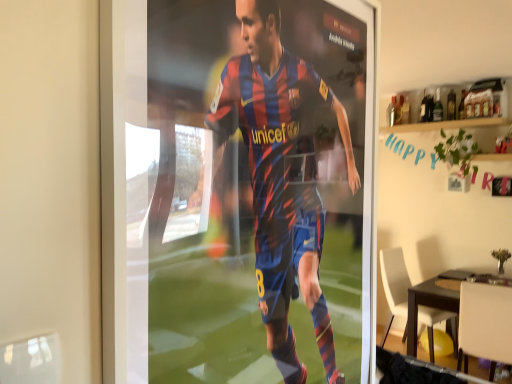
Describe the element at coordinates (485, 324) in the screenshot. I see `white matte chair at lower right, which appears as the first chair when viewed from the front` at that location.

At what (x,y) coordinates should I click in order to perform the action: click on white plastic chair at lower right, the 2th chair from the front. Please return your answer as a coordinate pair (x, y). Looking at the image, I should click on (394, 284).

I want to click on white matte chair at lower right, which appears as the first chair when viewed from the front, so click(485, 324).

Is point (456, 320) closer to camera compared to point (386, 261)?

Yes, it is.

Is dark brown wooden table at lower right facing towards white plastic chair at lower right, arranged as the first chair when viewed from the back?

No, dark brown wooden table at lower right does not turn towards white plastic chair at lower right, arranged as the first chair when viewed from the back.

Would you say dark brown wooden table at lower right is to the left or to the right of white plastic chair at lower right, the 2th chair from the front, in the picture?

From the image, it's evident that dark brown wooden table at lower right is to the right of white plastic chair at lower right, the 2th chair from the front.

From the image's perspective, does dark brown wooden table at lower right appear higher than white plastic chair at lower right, arranged as the first chair when viewed from the back?

No, from the image's perspective, dark brown wooden table at lower right is not above white plastic chair at lower right, arranged as the first chair when viewed from the back.

In the scene shown: Would you say dark brown wooden table at lower right is to the left or to the right of white matte chair at lower right, which ranks as the 2th chair in back-to-front order, in the picture?

dark brown wooden table at lower right is positioned on white matte chair at lower right, which ranks as the 2th chair in back-to-front order,'s right side.

Considering the sizes of dark brown wooden table at lower right and white matte chair at lower right, which ranks as the 2th chair in back-to-front order, in the image, is dark brown wooden table at lower right taller or shorter than white matte chair at lower right, which ranks as the 2th chair in back-to-front order,?

Clearly, dark brown wooden table at lower right is shorter compared to white matte chair at lower right, which ranks as the 2th chair in back-to-front order.

Considering the relative sizes of dark brown wooden table at lower right and white matte chair at lower right, which ranks as the 2th chair in back-to-front order, in the image provided, is dark brown wooden table at lower right wider than white matte chair at lower right, which ranks as the 2th chair in back-to-front order,?

Yes.

From a real-world perspective, is dark brown wooden table at lower right positioned over white matte chair at lower right, which appears as the first chair when viewed from the front, based on gravity?

No, from a real-world perspective, dark brown wooden table at lower right is not above white matte chair at lower right, which appears as the first chair when viewed from the front.

Between white plastic chair at lower right, the 2th chair from the front, and dark brown wooden table at lower right, which one has more height?

white plastic chair at lower right, the 2th chair from the front, is taller.

In the image, is white plastic chair at lower right, arranged as the first chair when viewed from the back, on the left side or the right side of dark brown wooden table at lower right?

white plastic chair at lower right, arranged as the first chair when viewed from the back, is to the left of dark brown wooden table at lower right.

From the image's perspective, is white plastic chair at lower right, arranged as the first chair when viewed from the back, positioned above or below dark brown wooden table at lower right?

From the image's perspective, white plastic chair at lower right, arranged as the first chair when viewed from the back, appears above dark brown wooden table at lower right.

At what (x,y) coordinates should I click in order to perform the action: click on table to the right of white plastic chair at lower right, the 2th chair from the front. Please return your answer as a coordinate pair (x, y). Looking at the image, I should click on (433, 299).

Which object is positioned more to the left, white plastic chair at lower right, the 2th chair from the front, or white matte chair at lower right, which appears as the first chair when viewed from the front?

From the viewer's perspective, white plastic chair at lower right, the 2th chair from the front, appears more on the left side.

How distant is white plastic chair at lower right, the 2th chair from the front, from white matte chair at lower right, which appears as the first chair when viewed from the front?

The distance of white plastic chair at lower right, the 2th chair from the front, from white matte chair at lower right, which appears as the first chair when viewed from the front, is 3.86 feet.

Consider the image. From the image's perspective, relative to white matte chair at lower right, which ranks as the 2th chair in back-to-front order, is white plastic chair at lower right, arranged as the first chair when viewed from the back, above or below?

white plastic chair at lower right, arranged as the first chair when viewed from the back, is situated higher than white matte chair at lower right, which ranks as the 2th chair in back-to-front order, in the image.

You are a GUI agent. You are given a task and a screenshot of the screen. Output one action in this format:
    pyautogui.click(x=<x>, y=<y>)
    Task: Click on the chair that is below the white plastic chair at lower right, arranged as the first chair when viewed from the back (from the image's perspective)
    The width and height of the screenshot is (512, 384).
    Given the screenshot: What is the action you would take?
    pyautogui.click(x=485, y=324)

Consider the image. Which is more distant, (510,313) or (441,298)?

The point (441,298) is farther from the camera.

Is white matte chair at lower right, which appears as the first chair when viewed from the front, not within dark brown wooden table at lower right?

Actually, white matte chair at lower right, which appears as the first chair when viewed from the front, is at least partially inside dark brown wooden table at lower right.

Between white matte chair at lower right, which ranks as the 2th chair in back-to-front order, and dark brown wooden table at lower right, which one appears on the right side from the viewer's perspective?

dark brown wooden table at lower right.

Is the depth of white matte chair at lower right, which ranks as the 2th chair in back-to-front order, greater than that of dark brown wooden table at lower right?

No, it is not.

From the picture: Does white matte chair at lower right, which appears as the first chair when viewed from the front, have a lesser height compared to white plastic chair at lower right, arranged as the first chair when viewed from the back?

Yes, white matte chair at lower right, which appears as the first chair when viewed from the front, is shorter than white plastic chair at lower right, arranged as the first chair when viewed from the back.

Can we say white matte chair at lower right, which ranks as the 2th chair in back-to-front order, lies outside white plastic chair at lower right, arranged as the first chair when viewed from the back?

Yes, white matte chair at lower right, which ranks as the 2th chair in back-to-front order, is not within white plastic chair at lower right, arranged as the first chair when viewed from the back.

In terms of width, does white matte chair at lower right, which ranks as the 2th chair in back-to-front order, look wider or thinner when compared to white plastic chair at lower right, arranged as the first chair when viewed from the back?

In the image, white matte chair at lower right, which ranks as the 2th chair in back-to-front order, appears to be wider than white plastic chair at lower right, arranged as the first chair when viewed from the back.

From a real-world perspective, is white matte chair at lower right, which appears as the first chair when viewed from the front, under white plastic chair at lower right, arranged as the first chair when viewed from the back?

Actually, white matte chair at lower right, which appears as the first chair when viewed from the front, is physically above white plastic chair at lower right, arranged as the first chair when viewed from the back, in the real world.

This screenshot has width=512, height=384. I want to click on table below the white plastic chair at lower right, the 2th chair from the front (from a real-world perspective), so click(433, 299).

Identify the location of table behind the white matte chair at lower right, which appears as the first chair when viewed from the front. The height and width of the screenshot is (384, 512). click(433, 299).

Looking at the image, which one is located further to dark brown wooden table at lower right, white matte chair at lower right, which appears as the first chair when viewed from the front, or white plastic chair at lower right, the 2th chair from the front?

white matte chair at lower right, which appears as the first chair when viewed from the front, is further to dark brown wooden table at lower right.

In the scene shown: Which object lies further to the anchor point white matte chair at lower right, which appears as the first chair when viewed from the front, white plastic chair at lower right, the 2th chair from the front, or dark brown wooden table at lower right?

white plastic chair at lower right, the 2th chair from the front, is positioned further to the anchor white matte chair at lower right, which appears as the first chair when viewed from the front.

From the picture: Considering their positions, is dark brown wooden table at lower right positioned closer to white matte chair at lower right, which appears as the first chair when viewed from the front, than white plastic chair at lower right, the 2th chair from the front?

dark brown wooden table at lower right lies closer to white matte chair at lower right, which appears as the first chair when viewed from the front, than the other object.

Based on the photo, when comparing their distances from white plastic chair at lower right, the 2th chair from the front, does dark brown wooden table at lower right or white matte chair at lower right, which appears as the first chair when viewed from the front, seem further?

Among the two, white matte chair at lower right, which appears as the first chair when viewed from the front, is located further to white plastic chair at lower right, the 2th chair from the front.

Estimate the real-world distances between objects in this image. Which object is closer to white plastic chair at lower right, the 2th chair from the front, white matte chair at lower right, which ranks as the 2th chair in back-to-front order, or dark brown wooden table at lower right?

dark brown wooden table at lower right.

Looking at this image, based on their spatial positions, is white plastic chair at lower right, the 2th chair from the front, or white matte chair at lower right, which appears as the first chair when viewed from the front, closer to dark brown wooden table at lower right?

Among the two, white plastic chair at lower right, the 2th chair from the front, is located nearer to dark brown wooden table at lower right.

Where is `table between white matte chair at lower right, which appears as the first chair when viewed from the front, and white plastic chair at lower right, the 2th chair from the front, in the front-back direction`? The height and width of the screenshot is (384, 512). table between white matte chair at lower right, which appears as the first chair when viewed from the front, and white plastic chair at lower right, the 2th chair from the front, in the front-back direction is located at coordinates (433, 299).